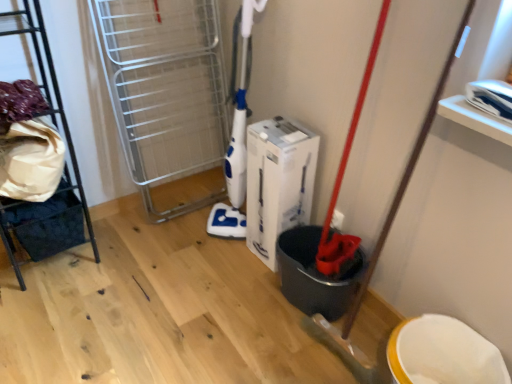
The width and height of the screenshot is (512, 384). Find the location of `metallic black rack at left`. metallic black rack at left is located at coordinates click(x=63, y=168).

Image resolution: width=512 pixels, height=384 pixels. What do you see at coordinates (63, 168) in the screenshot?
I see `metallic black rack at left` at bounding box center [63, 168].

In order to face white cardboard box at center, should I rotate leftwards or rightwards?

You should look right and rotate roughly 3.269 degrees.

What do you see at coordinates (278, 182) in the screenshot? I see `white cardboard box at center` at bounding box center [278, 182].

Locate an element on the screen. The width and height of the screenshot is (512, 384). white cardboard box at center is located at coordinates (278, 182).

You are a GUI agent. You are given a task and a screenshot of the screen. Output one action in this format:
    pyautogui.click(x=<x>, y=<y>)
    Task: Click on the metallic black rack at left
    Image resolution: width=512 pixels, height=384 pixels.
    Given the screenshot: What is the action you would take?
    (x=63, y=168)

Considering the relative positions of metallic black rack at left and white cardboard box at center in the image provided, is metallic black rack at left to the right of white cardboard box at center from the viewer's perspective?

Incorrect, metallic black rack at left is not on the right side of white cardboard box at center.

Is metallic black rack at left closer to the viewer compared to white cardboard box at center?

Yes, the depth of metallic black rack at left is less than that of white cardboard box at center.

Which is less distant, (33, 252) or (300, 164)?

Point (33, 252) appears to be farther away from the viewer than point (300, 164).

In the scene shown: From the image's perspective, is metallic black rack at left located above or below white cardboard box at center?

Clearly, from the image's perspective, metallic black rack at left is above white cardboard box at center.

From a real-world perspective, between metallic black rack at left and white cardboard box at center, who is vertically higher?

In real-world perspective, metallic black rack at left is above.

Does metallic black rack at left have a greater width compared to white cardboard box at center?

Correct, the width of metallic black rack at left exceeds that of white cardboard box at center.

Which of these two, metallic black rack at left or white cardboard box at center, stands taller?

metallic black rack at left is taller.

From the picture: Considering the relative sizes of metallic black rack at left and white cardboard box at center in the image provided, is metallic black rack at left smaller than white cardboard box at center?

Incorrect, metallic black rack at left is not smaller in size than white cardboard box at center.

Can white cardboard box at center be found inside metallic black rack at left?

No, white cardboard box at center is not a part of metallic black rack at left.

Would you say metallic black rack at left is a long distance from white cardboard box at center?

No, metallic black rack at left is in close proximity to white cardboard box at center.

Could you tell me if metallic black rack at left is turned towards white cardboard box at center?

No, metallic black rack at left is not aimed at white cardboard box at center.

Can you tell me how much metallic black rack at left and white cardboard box at center differ in facing direction?

They differ by 88.8 degrees in their facing directions.

How distant is metallic black rack at left from white cardboard box at center?

metallic black rack at left is 32.16 inches from white cardboard box at center.

Where is `furniture that is on the left side of white cardboard box at center`? This screenshot has height=384, width=512. furniture that is on the left side of white cardboard box at center is located at coordinates (63, 168).

Can you confirm if white cardboard box at center is positioned to the right of metallic black rack at left?

Correct, you'll find white cardboard box at center to the right of metallic black rack at left.

Is the position of white cardboard box at center more distant than that of metallic black rack at left?

Yes, the depth of white cardboard box at center is greater than that of metallic black rack at left.

Considering the points (259, 242) and (49, 118), which point is behind, point (259, 242) or point (49, 118)?

The point (259, 242) is behind.

From the image's perspective, would you say white cardboard box at center is shown under metallic black rack at left?

Yes, from the image's perspective, white cardboard box at center is beneath metallic black rack at left.

From a real-world perspective, is white cardboard box at center below metallic black rack at left?

Yes, from a real-world perspective, white cardboard box at center is below metallic black rack at left.

In terms of width, does white cardboard box at center look wider or thinner when compared to metallic black rack at left?

In the image, white cardboard box at center appears to be more narrow than metallic black rack at left.

Can you confirm if white cardboard box at center is taller than metallic black rack at left?

Incorrect, the height of white cardboard box at center is not larger of that of metallic black rack at left.

Considering the relative sizes of white cardboard box at center and metallic black rack at left in the image provided, is white cardboard box at center smaller than metallic black rack at left?

Yes, white cardboard box at center is smaller than metallic black rack at left.

Is white cardboard box at center spatially inside metallic black rack at left, or outside of it?

white cardboard box at center exists outside the volume of metallic black rack at left.

Is white cardboard box at center not close to metallic black rack at left?

No, white cardboard box at center is not far from metallic black rack at left.

Is white cardboard box at center looking in the opposite direction of metallic black rack at left?

white cardboard box at center does not have its back to metallic black rack at left.

How different are the orientations of white cardboard box at center and metallic black rack at left in degrees?

They differ by 88.8 degrees in their facing directions.

In order to click on wide below the metallic black rack at left (from a real-world perspective) in this screenshot , I will do `click(278, 182)`.

Where is `wide that is below the metallic black rack at left (from the image's perspective)`? The width and height of the screenshot is (512, 384). wide that is below the metallic black rack at left (from the image's perspective) is located at coordinates (278, 182).

Identify the location of furniture that appears in front of the white cardboard box at center. point(63,168).